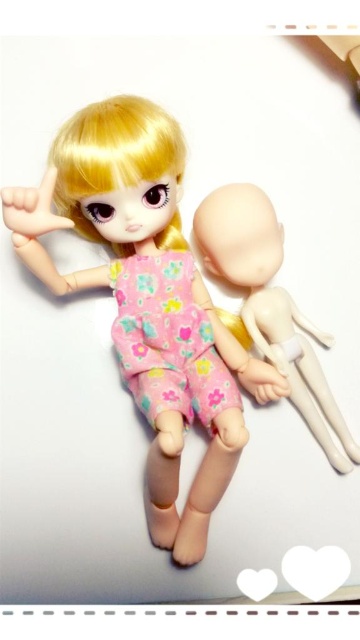
Is matte pink fabric doll at center bigger than smooth beige head at center?

Correct, matte pink fabric doll at center is larger in size than smooth beige head at center.

Who is lower down, matte pink fabric doll at center or smooth beige head at center?

Positioned lower is matte pink fabric doll at center.

The image size is (360, 640). I want to click on matte pink fabric doll at center, so click(x=147, y=300).

You are a GUI agent. You are given a task and a screenshot of the screen. Output one action in this format:
    pyautogui.click(x=<x>, y=<y>)
    Task: Click on the matte pink fabric doll at center
    The width and height of the screenshot is (360, 640).
    Given the screenshot: What is the action you would take?
    pyautogui.click(x=147, y=300)